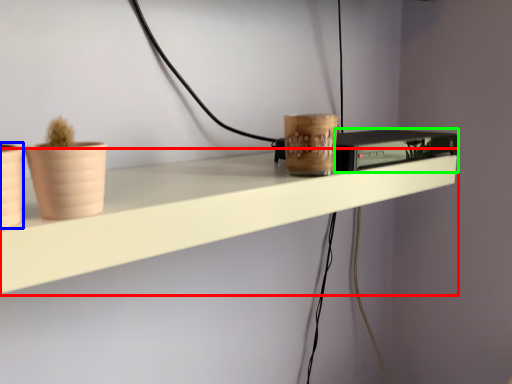
Question: Based on their relative distances, which object is farther from shelf (highlighted by a red box)? Choose from flowerpot (highlighted by a blue box) and appliance (highlighted by a green box).

Choices:
 (A) flowerpot
 (B) appliance

Answer: (A)